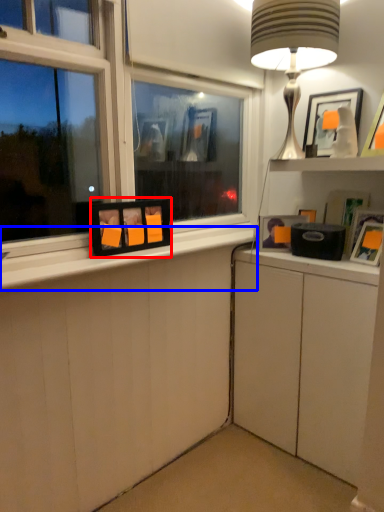
Question: Which object appears closest to the camera in this image, picture frame (highlighted by a red box) or window sill (highlighted by a blue box)?

Choices:
 (A) picture frame
 (B) window sill

Answer: (B)